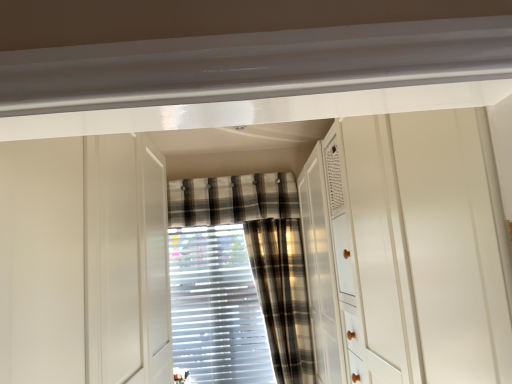
The image size is (512, 384). Describe the element at coordinates (407, 250) in the screenshot. I see `white glossy dresser at center` at that location.

What is the approximate height of white glossy dresser at center?

1.41 meters.

The width and height of the screenshot is (512, 384). What do you see at coordinates (260, 253) in the screenshot?
I see `plaid fabric curtain at center, the 3th curtain positioned from the front` at bounding box center [260, 253].

Locate an element on the screen. white glossy dresser at center is located at coordinates (407, 250).

In the scene shown: From the image's perspective, which one is positioned higher, plaid fabric curtain at center, acting as the 2th curtain starting from the front, or white glossy cabinet at center?

plaid fabric curtain at center, acting as the 2th curtain starting from the front, from the image's perspective.

Can you confirm if plaid fabric curtain at center, which ranks as the second curtain in back-to-front order, is smaller than white glossy cabinet at center?

Yes, plaid fabric curtain at center, which ranks as the second curtain in back-to-front order, is smaller than white glossy cabinet at center.

Consider the image. How distant is plaid fabric curtain at center, acting as the 2th curtain starting from the front, from white glossy cabinet at center?

plaid fabric curtain at center, acting as the 2th curtain starting from the front, is 1.43 meters away from white glossy cabinet at center.

Can you tell me how much plaid fabric curtain at center, acting as the 2th curtain starting from the front, and white glossy cabinet at center differ in facing direction?

They differ by 90 degrees in their facing directions.

How much distance is there between plaid fabric curtain at center, the third curtain from the back, and plaid fabric curtain at center, which ranks as the second curtain in back-to-front order?

They are 16.12 inches apart.

Looking at their sizes, would you say plaid fabric curtain at center, the first curtain from the front, is wider or thinner than plaid fabric curtain at center, which ranks as the second curtain in back-to-front order?

Clearly, plaid fabric curtain at center, the first curtain from the front, has more width compared to plaid fabric curtain at center, which ranks as the second curtain in back-to-front order.

Between plaid fabric curtain at center, the first curtain from the front, and plaid fabric curtain at center, which ranks as the second curtain in back-to-front order, which one has less height?

plaid fabric curtain at center, which ranks as the second curtain in back-to-front order, is shorter.

Considering their positions, is plaid fabric curtain at center, the first curtain from the front, located in front of or behind plaid fabric curtain at center, which ranks as the second curtain in back-to-front order?

Clearly, plaid fabric curtain at center, the first curtain from the front, is in front of plaid fabric curtain at center, which ranks as the second curtain in back-to-front order.

From a real-world perspective, which object rests below the other?

plaid fabric curtain at center, the first curtain from the front.

Is the position of white glossy cabinet at center less distant than that of plaid fabric curtain at center, the third curtain from the back?

That is True.

Is white glossy cabinet at center positioned beyond the bounds of plaid fabric curtain at center, the first curtain from the front?

white glossy cabinet at center lies outside plaid fabric curtain at center, the first curtain from the front,'s area.

Is plaid fabric curtain at center, the 3th curtain positioned from the front, at the left side of plaid fabric curtain at center, which ranks as the second curtain in back-to-front order?

Yes.

Considering the positions of points (287, 317) and (258, 186), is point (287, 317) closer to camera compared to point (258, 186)?

That is True.

Considering the sizes of objects plaid fabric curtain at center, the first curtain viewed from the back, and plaid fabric curtain at center, which ranks as the second curtain in back-to-front order, in the image provided, who is wider, plaid fabric curtain at center, the first curtain viewed from the back, or plaid fabric curtain at center, which ranks as the second curtain in back-to-front order,?

plaid fabric curtain at center, which ranks as the second curtain in back-to-front order.

How many degrees apart are the facing directions of white glossy cabinet at center and plaid fabric curtain at center, which ranks as the second curtain in back-to-front order?

There is a 90-degree angle between the facing directions of white glossy cabinet at center and plaid fabric curtain at center, which ranks as the second curtain in back-to-front order.

Does white glossy cabinet at center turn towards plaid fabric curtain at center, acting as the 2th curtain starting from the front?

No, white glossy cabinet at center does not turn towards plaid fabric curtain at center, acting as the 2th curtain starting from the front.

Which object is positioned more to the left, white glossy cabinet at center or plaid fabric curtain at center, acting as the 2th curtain starting from the front?

Positioned to the left is white glossy cabinet at center.

Could plaid fabric curtain at center, acting as the 2th curtain starting from the front, be considered to be inside white glossy cabinet at center?

No, white glossy cabinet at center does not contain plaid fabric curtain at center, acting as the 2th curtain starting from the front.

Are plaid fabric curtain at center, the first curtain viewed from the back, and white glossy cabinet at center making contact?

There is a gap between plaid fabric curtain at center, the first curtain viewed from the back, and white glossy cabinet at center.

Is plaid fabric curtain at center, the first curtain viewed from the back, positioned beyond the bounds of white glossy cabinet at center?

Absolutely, plaid fabric curtain at center, the first curtain viewed from the back, is external to white glossy cabinet at center.

Is plaid fabric curtain at center, the 3th curtain positioned from the front, further to the viewer compared to white glossy cabinet at center?

Yes.

At what (x,y) coordinates should I click in order to perform the action: click on cabinetry in front of the plaid fabric curtain at center, the first curtain viewed from the back. Please return your answer as a coordinate pair (x, y). This screenshot has height=384, width=512. Looking at the image, I should click on (84, 261).

Considering the sizes of plaid fabric curtain at center, acting as the 2th curtain starting from the front, and white glossy dresser at center in the image, is plaid fabric curtain at center, acting as the 2th curtain starting from the front, bigger or smaller than white glossy dresser at center?

In the image, plaid fabric curtain at center, acting as the 2th curtain starting from the front, appears to be smaller than white glossy dresser at center.

Is point (170, 217) in front of point (413, 131)?

No, it is behind (413, 131).

Does plaid fabric curtain at center, acting as the 2th curtain starting from the front, have a greater height compared to white glossy dresser at center?

In fact, plaid fabric curtain at center, acting as the 2th curtain starting from the front, may be shorter than white glossy dresser at center.

Identify the location of cabinetry lying on the left of plaid fabric curtain at center, which ranks as the second curtain in back-to-front order. This screenshot has width=512, height=384. (84, 261).

Find the location of a particular element. the 1st curtain located beneath the plaid fabric curtain at center, which ranks as the second curtain in back-to-front order (from a real-world perspective) is located at coordinates (282, 295).

Estimate the real-world distances between objects in this image. Which object is further from white glossy dresser at center, plaid fabric curtain at center, the first curtain viewed from the back, or white glossy cabinet at center?

plaid fabric curtain at center, the first curtain viewed from the back, is further to white glossy dresser at center.

Based on their spatial positions, is white glossy cabinet at center or plaid fabric curtain at center, the first curtain from the front, closer to plaid fabric curtain at center, acting as the 2th curtain starting from the front?

The object closer to plaid fabric curtain at center, acting as the 2th curtain starting from the front, is plaid fabric curtain at center, the first curtain from the front.

From the image, which object appears to be nearer to plaid fabric curtain at center, acting as the 2th curtain starting from the front, white glossy cabinet at center or plaid fabric curtain at center, the first curtain viewed from the back?

plaid fabric curtain at center, the first curtain viewed from the back.

Looking at the image, which one is located closer to plaid fabric curtain at center, acting as the 2th curtain starting from the front, white glossy dresser at center or white glossy cabinet at center?

Among the two, white glossy dresser at center is located nearer to plaid fabric curtain at center, acting as the 2th curtain starting from the front.

Which object lies nearer to the anchor point white glossy dresser at center, plaid fabric curtain at center, which ranks as the second curtain in back-to-front order, or plaid fabric curtain at center, the third curtain from the back?

plaid fabric curtain at center, the third curtain from the back.

Looking at the image, which one is located further to plaid fabric curtain at center, acting as the 2th curtain starting from the front, plaid fabric curtain at center, the third curtain from the back, or white glossy dresser at center?

white glossy dresser at center lies further to plaid fabric curtain at center, acting as the 2th curtain starting from the front, than the other object.

Looking at the image, which one is located closer to white glossy cabinet at center, plaid fabric curtain at center, acting as the 2th curtain starting from the front, or white glossy dresser at center?

white glossy dresser at center.

Looking at the image, which one is located further to plaid fabric curtain at center, the first curtain from the front, plaid fabric curtain at center, the first curtain viewed from the back, or plaid fabric curtain at center, acting as the 2th curtain starting from the front?

Among the two, plaid fabric curtain at center, acting as the 2th curtain starting from the front, is located further to plaid fabric curtain at center, the first curtain from the front.

Where is `curtain between plaid fabric curtain at center, which ranks as the second curtain in back-to-front order, and plaid fabric curtain at center, the 3th curtain positioned from the front, from top to bottom`? The width and height of the screenshot is (512, 384). curtain between plaid fabric curtain at center, which ranks as the second curtain in back-to-front order, and plaid fabric curtain at center, the 3th curtain positioned from the front, from top to bottom is located at coordinates (282, 295).

Find the location of a particular element. curtain between white glossy cabinet at center and plaid fabric curtain at center, which ranks as the second curtain in back-to-front order, in the front-back direction is located at coordinates (282, 295).

This screenshot has height=384, width=512. I want to click on cabinetry between white glossy dresser at center and plaid fabric curtain at center, the third curtain from the back, along the z-axis, so click(84, 261).

At what (x,y) coordinates should I click in order to perform the action: click on cabinetry positioned between white glossy dresser at center and plaid fabric curtain at center, acting as the 2th curtain starting from the front, from near to far. Please return your answer as a coordinate pair (x, y). Looking at the image, I should click on (84, 261).